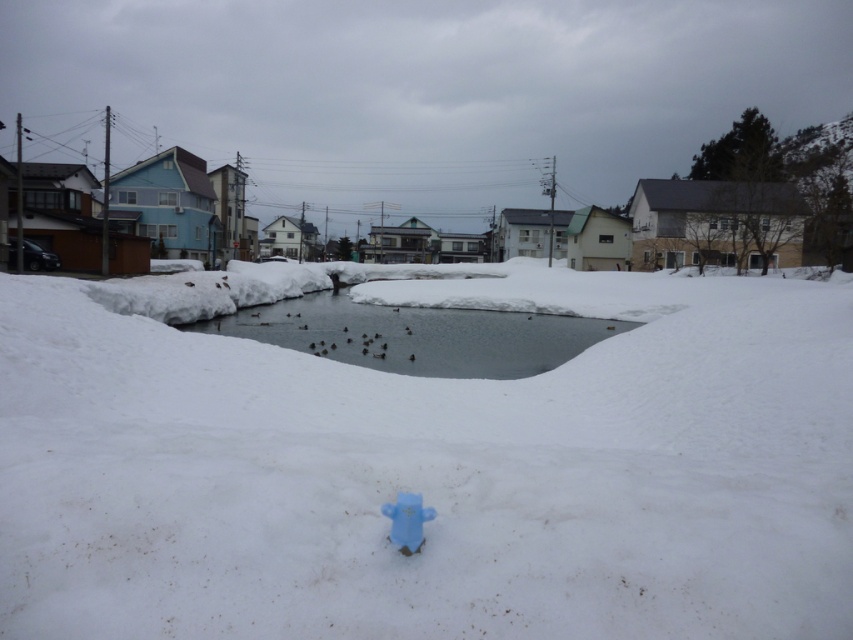
Between white fluffy snow at center and blue plastic hydrant at center, which one appears on the right side from the viewer's perspective?

From the viewer's perspective, white fluffy snow at center appears more on the right side.

Who is shorter, white fluffy snow at center or blue plastic hydrant at center?

Standing shorter between the two is blue plastic hydrant at center.

Locate an element on the screen. This screenshot has width=853, height=640. white fluffy snow at center is located at coordinates (426, 465).

The width and height of the screenshot is (853, 640). What are the coordinates of `white fluffy snow at center` in the screenshot? It's located at (426, 465).

Between clear ice water at center and blue plastic hydrant at center, which one has less height?

Standing shorter between the two is blue plastic hydrant at center.

Is clear ice water at center smaller than blue plastic hydrant at center?

No, clear ice water at center is not smaller than blue plastic hydrant at center.

Is point (374, 355) positioned after point (413, 531)?

Yes, it is behind point (413, 531).

Identify the location of clear ice water at center. (416, 333).

Can you confirm if white fluffy snow at center is positioned to the right of clear ice water at center?

Yes, white fluffy snow at center is to the right of clear ice water at center.

Is point (171, 552) farther from viewer compared to point (439, 310)?

No, it is in front of (439, 310).

Which is in front, point (553, 372) or point (479, 372)?

Positioned in front is point (553, 372).

Where is `white fluffy snow at center`? This screenshot has width=853, height=640. white fluffy snow at center is located at coordinates (426, 465).